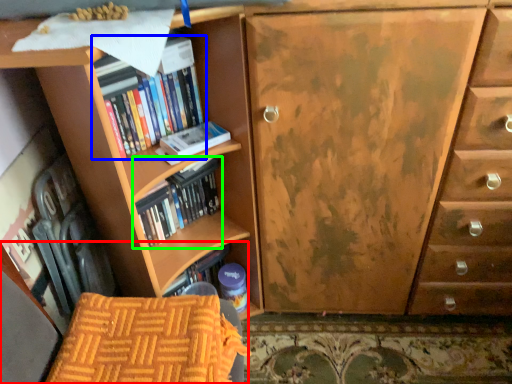
Question: Considering the real-world distances, which object is closest to armchair (highlighted by a red box)? book (highlighted by a blue box) or book (highlighted by a green box).

Choices:
 (A) book
 (B) book

Answer: (B)